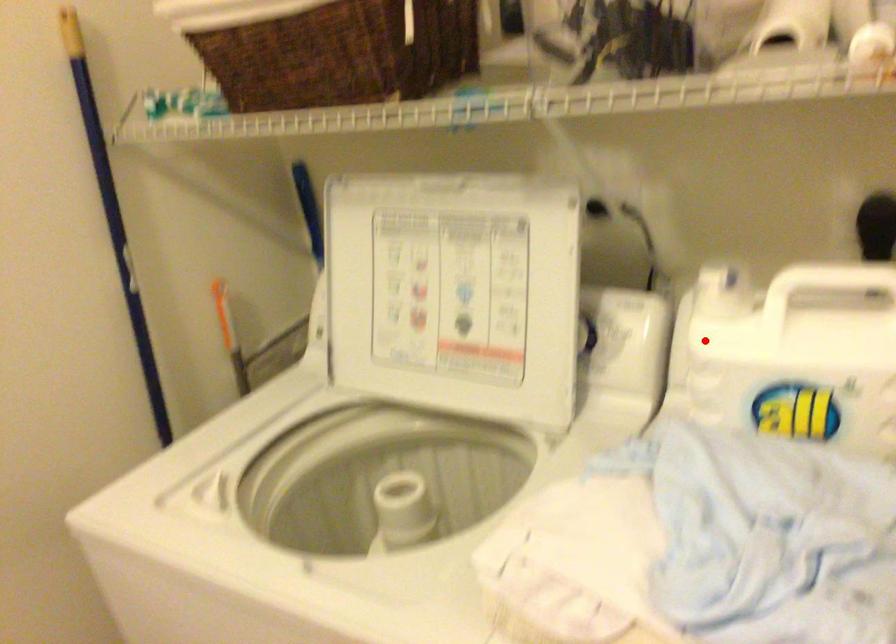
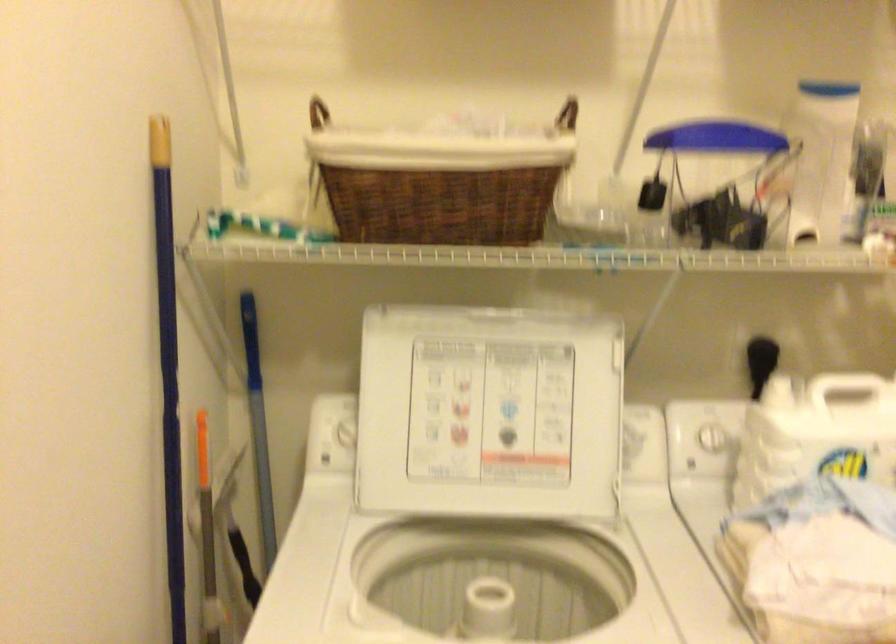
The point at the highlighted location is marked in the first image. Where is the corresponding point in the second image?

(698, 440)